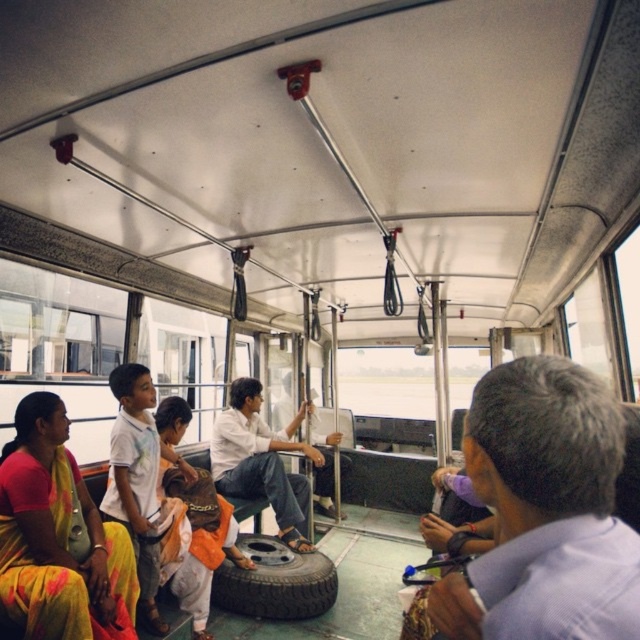
Question: Can you confirm if gray fabric shirt at right is wider than yellow cotton saree at lower left?

Choices:
 (A) yes
 (B) no

Answer: (B)

Question: Does gray fabric shirt at right appear under white matte shirt at center?

Choices:
 (A) no
 (B) yes

Answer: (A)

Question: Which of the following is the farthest from the observer?

Choices:
 (A) (330, 595)
 (B) (232, 429)

Answer: (B)

Question: Is yellow cotton saree at lower left thinner than dark gray rubber tire at center?

Choices:
 (A) no
 (B) yes

Answer: (B)

Question: Which object is positioned closest to the white matte shirt at center?

Choices:
 (A) dark gray rubber tire at center
 (B) gray fabric shirt at right
 (C) yellow cotton saree at lower left

Answer: (A)

Question: Which point is closer to the camera?

Choices:
 (A) (243, 426)
 (B) (93, 570)
 (C) (582, 588)

Answer: (C)